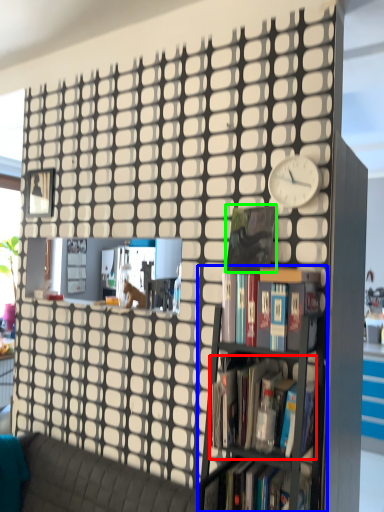
Question: Which is nearer to the book (highlighted by a red box)? bookcase (highlighted by a blue box) or paperback book (highlighted by a green box).

Choices:
 (A) bookcase
 (B) paperback book

Answer: (A)